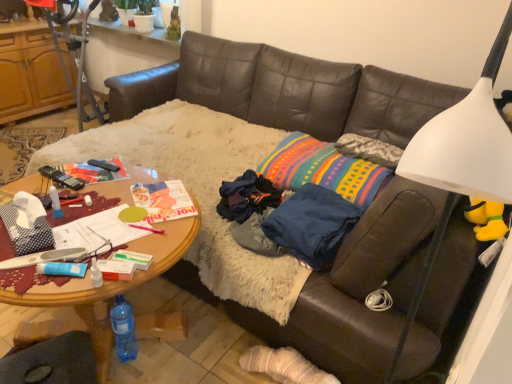
Question: From the image's perspective, is multicolored woven pillow at center over woodendesk at center?

Choices:
 (A) yes
 (B) no

Answer: (A)

Question: Is multicolored woven pillow at center at the right side of woodendesk at center?

Choices:
 (A) yes
 (B) no

Answer: (A)

Question: Is multicolored woven pillow at center aimed at woodendesk at center?

Choices:
 (A) no
 (B) yes

Answer: (B)

Question: Is multicolored woven pillow at center smaller than woodendesk at center?

Choices:
 (A) yes
 (B) no

Answer: (A)

Question: Can you confirm if multicolored woven pillow at center is thinner than woodendesk at center?

Choices:
 (A) no
 (B) yes

Answer: (B)

Question: Is point (335, 208) positioned closer to the camera than point (106, 162)?

Choices:
 (A) closer
 (B) farther

Answer: (A)

Question: Is dark blue fabric at center situated inside black plastic remote control at center or outside?

Choices:
 (A) outside
 (B) inside

Answer: (A)

Question: From a real-world perspective, is dark blue fabric at center physically located above or below black plastic remote control at center?

Choices:
 (A) above
 (B) below

Answer: (B)

Question: Considering the positions of dark blue fabric at center and black plastic remote control at center in the image, is dark blue fabric at center bigger or smaller than black plastic remote control at center?

Choices:
 (A) small
 (B) big

Answer: (B)

Question: Relative to woodendesk at center, is dark blue fabric at center in front or behind?

Choices:
 (A) behind
 (B) front

Answer: (A)

Question: In terms of size, does dark blue fabric at center appear bigger or smaller than woodendesk at center?

Choices:
 (A) big
 (B) small

Answer: (B)

Question: In terms of width, does dark blue fabric at center look wider or thinner when compared to woodendesk at center?

Choices:
 (A) thin
 (B) wide

Answer: (A)

Question: From their relative heights in the image, would you say dark blue fabric at center is taller or shorter than woodendesk at center?

Choices:
 (A) short
 (B) tall

Answer: (A)

Question: Is brown leather couch at center inside the boundaries of multicolored woven pillow at center, or outside?

Choices:
 (A) inside
 (B) outside

Answer: (B)

Question: Is brown leather couch at center in front of or behind multicolored woven pillow at center in the image?

Choices:
 (A) behind
 (B) front

Answer: (B)